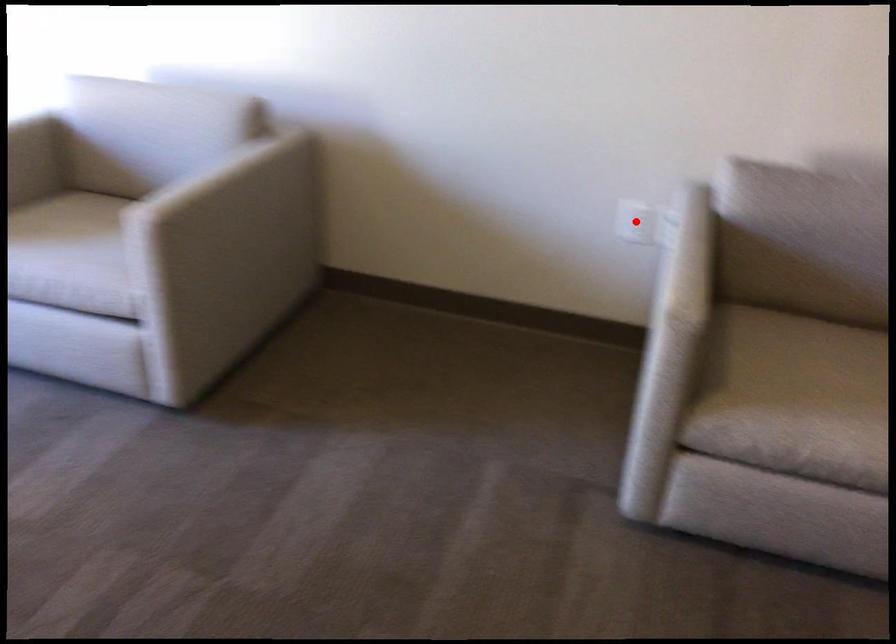
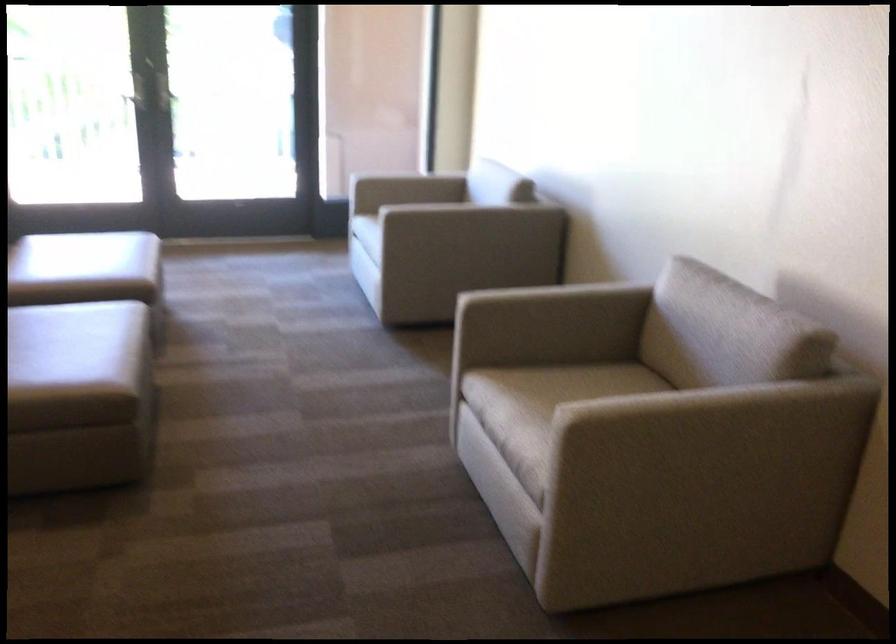
Question: I am providing you with two images of the same scene from different viewpoints. A red point is marked on the first image. Is the red point's position out of view in image 2?

Choices:
 (A) Yes
 (B) No

Answer: (A)